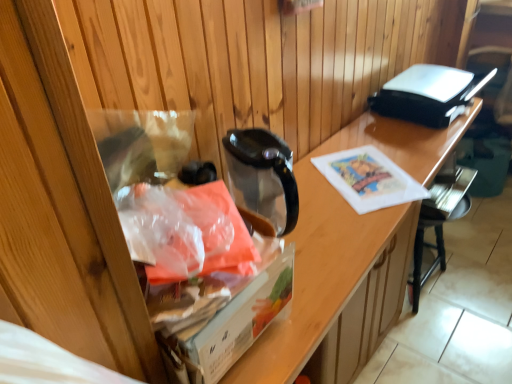
In order to face transparent plastic bag at left, should I rotate leftwards or rightwards?

To align with it, rotate right about 13.203°.

Where is `translucent plastic bag at left`? This screenshot has height=384, width=512. translucent plastic bag at left is located at coordinates (187, 227).

Does translucent plastic bag at left appear on the right side of black plastic toaster at upper right?

No.

Looking at their sizes, would you say translucent plastic bag at left is wider or thinner than black plastic toaster at upper right?

Clearly, translucent plastic bag at left has less width compared to black plastic toaster at upper right.

From a real-world perspective, is translucent plastic bag at left under black plastic toaster at upper right?

Actually, translucent plastic bag at left is physically above black plastic toaster at upper right in the real world.

Is translucent plastic bag at left facing towards black plastic toaster at upper right?

No, translucent plastic bag at left is not facing towards black plastic toaster at upper right.

Between black plastic chair at lower right and transparent plastic bag at left, which one has larger width?

With larger width is transparent plastic bag at left.

Can you tell me how much black plastic chair at lower right and transparent plastic bag at left differ in facing direction?

There is a 4.07-degree angle between the facing directions of black plastic chair at lower right and transparent plastic bag at left.

From a real-world perspective, which is physically above, black plastic chair at lower right or transparent plastic bag at left?

In real-world perspective, transparent plastic bag at left is above.

Considering the positions of objects black plastic chair at lower right and transparent plastic bag at left in the image provided, who is more to the right, black plastic chair at lower right or transparent plastic bag at left?

From the viewer's perspective, black plastic chair at lower right appears more on the right side.

Is point (451, 207) closer to viewer compared to point (458, 109)?

No, (451, 207) is behind (458, 109).

How different are the orientations of black plastic chair at lower right and black plastic toaster at upper right in degrees?

There is a 4.78-degree angle between the facing directions of black plastic chair at lower right and black plastic toaster at upper right.

Can you confirm if black plastic chair at lower right is wider than black plastic toaster at upper right?

No, black plastic chair at lower right is not wider than black plastic toaster at upper right.

Is black plastic chair at lower right with black plastic toaster at upper right?

There is a gap between black plastic chair at lower right and black plastic toaster at upper right.

What are the coordinates of `chair that appears on the right of black plastic toaster at upper right` in the screenshot? It's located at tap(440, 219).

Consider the image. Is black plastic toaster at upper right aimed at black plastic chair at lower right?

No.

From a real-world perspective, who is located lower, black plastic toaster at upper right or black plastic chair at lower right?

black plastic chair at lower right is physically lower.

From their relative heights in the image, would you say transparent plastic bag at left is taller or shorter than translucent plastic bag at left?

In the image, transparent plastic bag at left appears to be taller than translucent plastic bag at left.

In the image, there is a transparent plastic bag at left. Where is `material above it (from the image's perspective)`? The width and height of the screenshot is (512, 384). material above it (from the image's perspective) is located at coordinates (187, 227).

From a real-world perspective, relative to translucent plastic bag at left, is transparent plastic bag at left vertically above or below?

In terms of real-world spatial position, transparent plastic bag at left is below translucent plastic bag at left.

Considering the positions of objects transparent plastic bag at left and translucent plastic bag at left in the image provided, who is in front, transparent plastic bag at left or translucent plastic bag at left?

translucent plastic bag at left is in front.

Considering the relative positions of transparent plastic bag at left and black plastic toaster at upper right in the image provided, is transparent plastic bag at left behind black plastic toaster at upper right?

No, the depth of transparent plastic bag at left is less than that of black plastic toaster at upper right.

From a real-world perspective, is transparent plastic bag at left under black plastic toaster at upper right?

Indeed, from a real-world perspective, transparent plastic bag at left is positioned beneath black plastic toaster at upper right.

Considering the relative positions of transparent plastic bag at left and black plastic toaster at upper right in the image provided, is transparent plastic bag at left to the left or to the right of black plastic toaster at upper right?

Clearly, transparent plastic bag at left is on the left of black plastic toaster at upper right in the image.

Based on the photo, is transparent plastic bag at left positioned with its back to black plastic toaster at upper right?

No, transparent plastic bag at left's orientation is not away from black plastic toaster at upper right.

Is transparent plastic bag at left situated inside black plastic chair at lower right or outside?

transparent plastic bag at left is located beyond the bounds of black plastic chair at lower right.

From a real-world perspective, which object stands above the other?

In real-world perspective, transparent plastic bag at left is above.

Is transparent plastic bag at left turned away from black plastic chair at lower right?

Yes, transparent plastic bag at left is facing away from black plastic chair at lower right.

From the image's perspective, which one is positioned lower, transparent plastic bag at left or black plastic chair at lower right?

transparent plastic bag at left.

Locate an element on the screen. appliance behind the translucent plastic bag at left is located at coordinates (428, 94).

Where is `chair on the right of transparent plastic bag at left`? Image resolution: width=512 pixels, height=384 pixels. chair on the right of transparent plastic bag at left is located at coordinates (440, 219).

Which object lies nearer to the anchor point transparent plastic bag at left, black plastic toaster at upper right or translucent plastic bag at left?

The object closer to transparent plastic bag at left is black plastic toaster at upper right.

Based on their spatial positions, is black plastic toaster at upper right or transparent plastic bag at left closer to translucent plastic bag at left?

Among the two, transparent plastic bag at left is located nearer to translucent plastic bag at left.

Considering their positions, is translucent plastic bag at left positioned closer to black plastic toaster at upper right than transparent plastic bag at left?

Based on the image, transparent plastic bag at left appears to be nearer to black plastic toaster at upper right.

When comparing their distances from translucent plastic bag at left, does black plastic toaster at upper right or black plastic chair at lower right seem further?

black plastic chair at lower right.

Looking at the image, which one is located further to transparent plastic bag at left, black plastic toaster at upper right or black plastic chair at lower right?

The object further to transparent plastic bag at left is black plastic chair at lower right.

Considering their positions, is black plastic chair at lower right positioned further to translucent plastic bag at left than black plastic toaster at upper right?

black plastic chair at lower right is positioned further to the anchor translucent plastic bag at left.

When comparing their distances from transparent plastic bag at left, does black plastic chair at lower right or translucent plastic bag at left seem further?

black plastic chair at lower right is further to transparent plastic bag at left.

Estimate the real-world distances between objects in this image. Which object is further from black plastic toaster at upper right, black plastic chair at lower right or transparent plastic bag at left?

Among the two, black plastic chair at lower right is located further to black plastic toaster at upper right.

You are a GUI agent. You are given a task and a screenshot of the screen. Output one action in this format:
    pyautogui.click(x=<x>, y=<y>)
    Task: Click on the desk located between translucent plastic bag at left and black plastic chair at lower right in the depth direction
    
    Given the screenshot: What is the action you would take?
    pyautogui.click(x=340, y=240)

Where is `appliance between transparent plastic bag at left and black plastic chair at lower right in the front-back direction`? The height and width of the screenshot is (384, 512). appliance between transparent plastic bag at left and black plastic chair at lower right in the front-back direction is located at coordinates (428, 94).

Identify the location of appliance positioned between translucent plastic bag at left and black plastic chair at lower right from near to far. (428, 94).

Where is `desk between translucent plastic bag at left and black plastic toaster at upper right from left to right`? desk between translucent plastic bag at left and black plastic toaster at upper right from left to right is located at coordinates (340, 240).